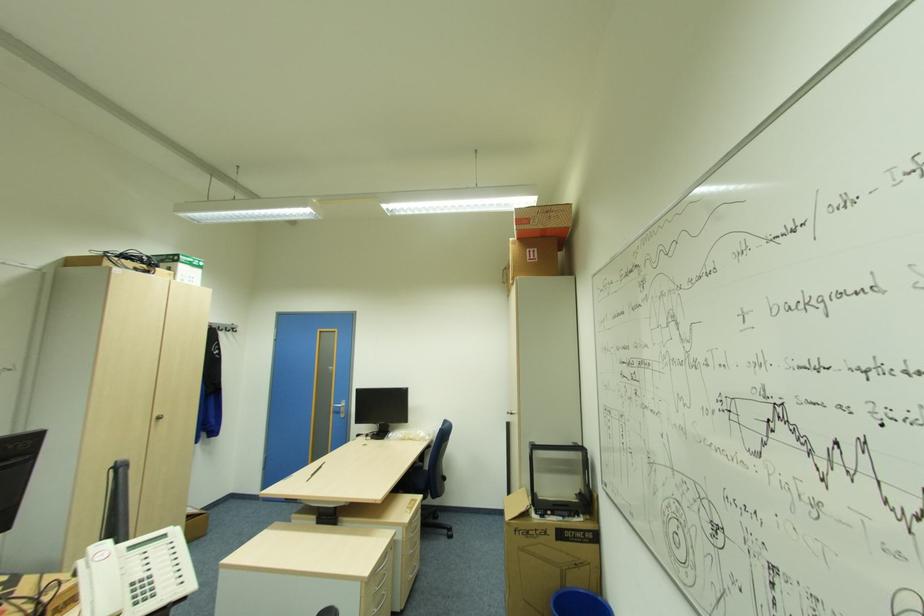
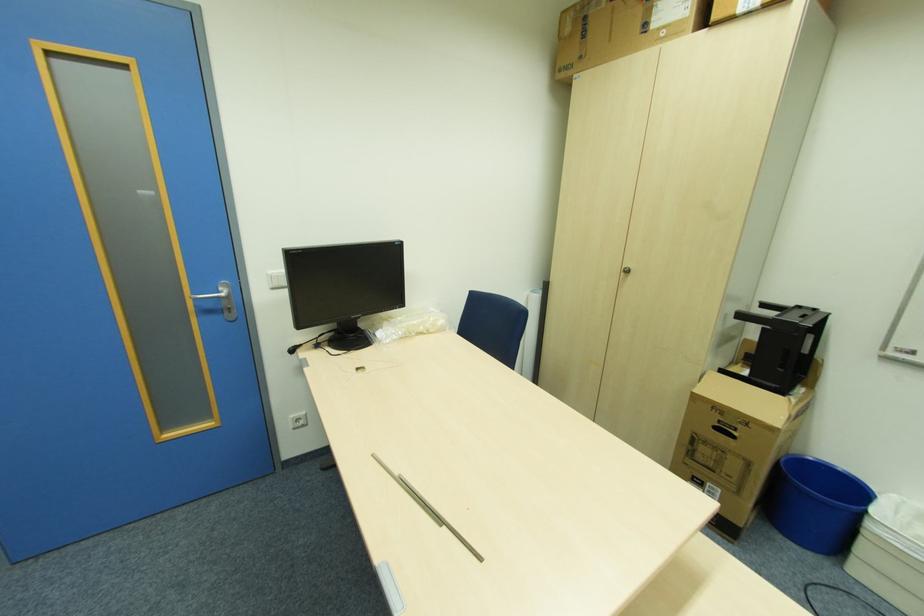
Locate, in the second image, the point that corresponds to point (414, 436) in the first image.

(424, 329)